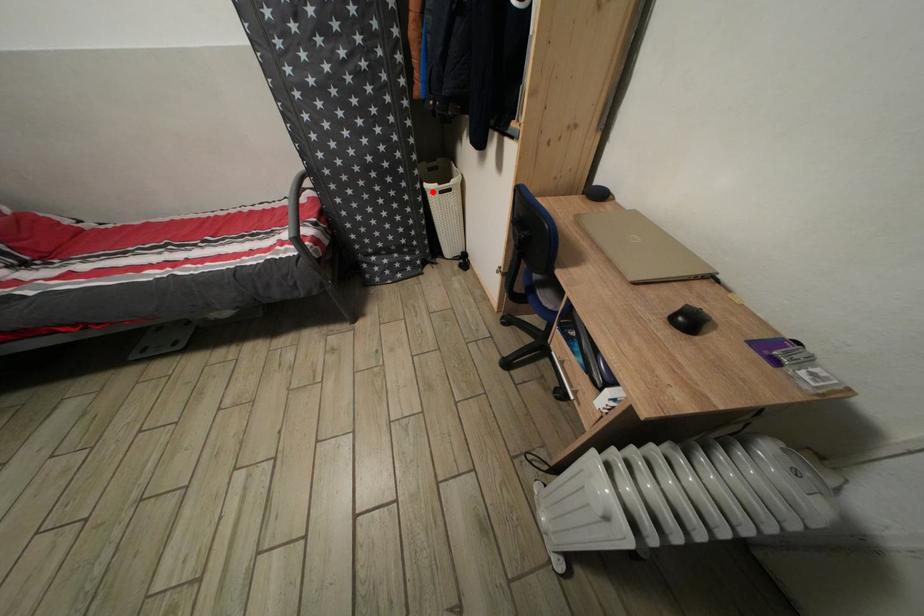
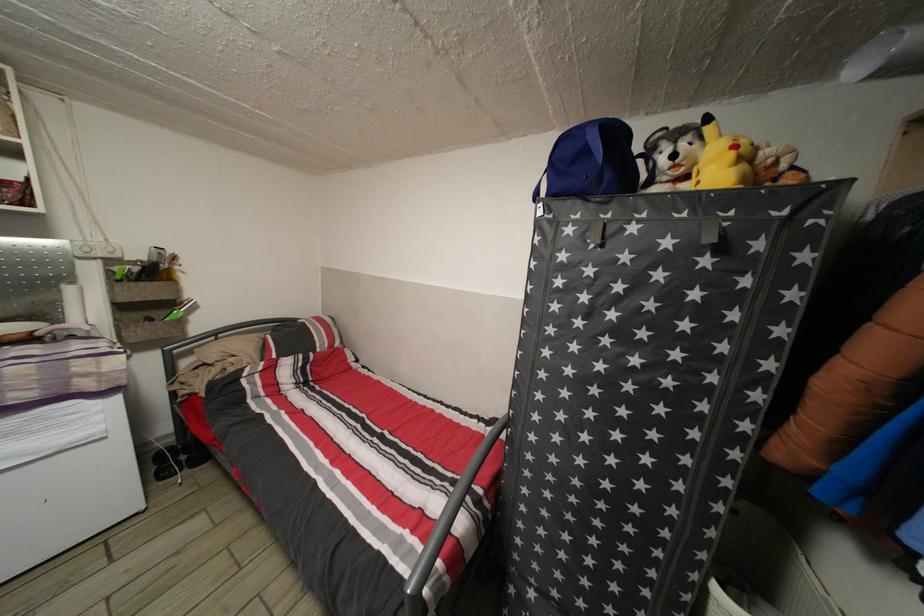
Question: I am providing you with two images of the same scene from different viewpoints. A red point is shown in image1. For the corresponding object point in image2, is it positioned nearer or farther from the camera?

Choices:
 (A) Nearer
 (B) Farther

Answer: (B)